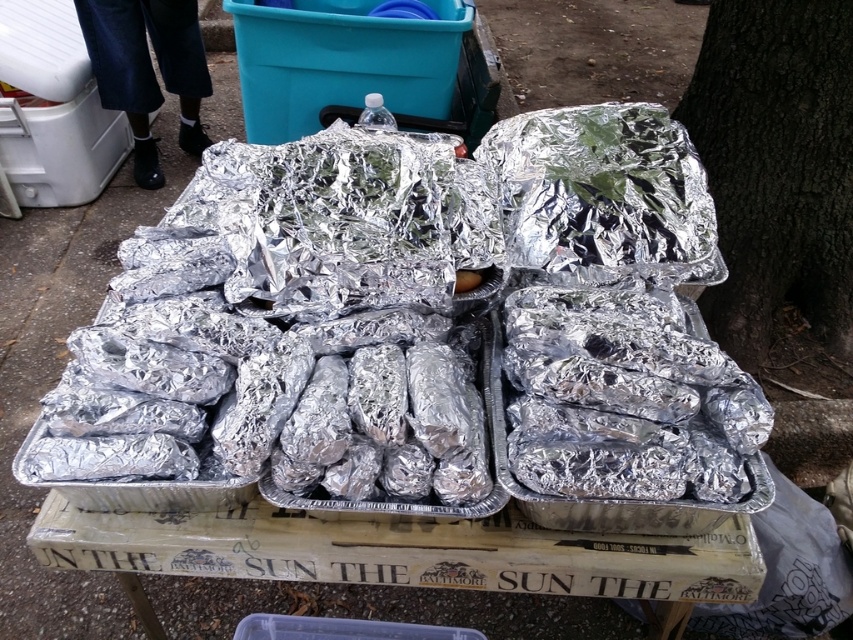
You are at an outdoor event in Baltimore and see the shiny metallic trays at center and the dark brown textured bark at right. Which object is positioned lower on the table?

The shiny metallic trays at center are positioned lower on the table than the dark brown textured bark at right.

You are at an outdoor event in Baltimore and need to find the dark brown textured bark at right. From the shiny metallic trays at center, which direction should you move to locate it?

The dark brown textured bark at right is to the right of the shiny metallic trays at center, so you should move to the right to locate it.

Based on the photo, you are a photographer taking pictures of the food items on the table. You notice two points marked on the table, one at point [527,221] and the other at point [851,120]. Which point will appear larger in your photo?

Point [527,221] is closer to the camera than point [851,120], so it will appear larger in the photo.